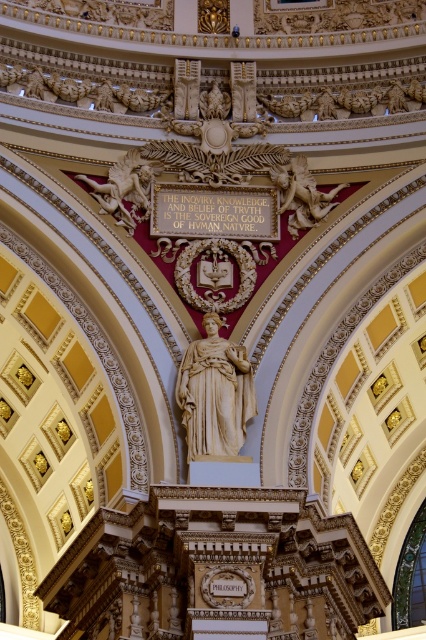
Between white marble statue at center and matte gold cherub at upper center, which one appears on the right side from the viewer's perspective?

From the viewer's perspective, matte gold cherub at upper center appears more on the right side.

Can you confirm if white marble statue at center is taller than matte gold cherub at upper center?

No, white marble statue at center is not taller than matte gold cherub at upper center.

Find the location of a particular element. white marble statue at center is located at coordinates pos(215,394).

Where is `white marble statue at center`? The height and width of the screenshot is (640, 426). white marble statue at center is located at coordinates (215, 394).

Does white marble winged horse at upper left have a smaller size compared to matte gold cherub at upper center?

Yes.

Is white marble winged horse at upper left thinner than matte gold cherub at upper center?

Correct, white marble winged horse at upper left's width is less than matte gold cherub at upper center's.

Who is more distant from viewer, (120,189) or (316,186)?

The point (316,186) is more distant.

You are a GUI agent. You are given a task and a screenshot of the screen. Output one action in this format:
    pyautogui.click(x=<x>, y=<y>)
    Task: Click on the white marble winged horse at upper left
    The height and width of the screenshot is (640, 426).
    Given the screenshot: What is the action you would take?
    pyautogui.click(x=124, y=188)

Looking at this image, does white marble statue at center appear on the right side of white marble winged horse at upper left?

Indeed, white marble statue at center is positioned on the right side of white marble winged horse at upper left.

Is point (213, 330) farther from viewer compared to point (123, 196)?

No, (213, 330) is in front of (123, 196).

This screenshot has height=640, width=426. What are the coordinates of `white marble statue at center` in the screenshot? It's located at (215, 394).